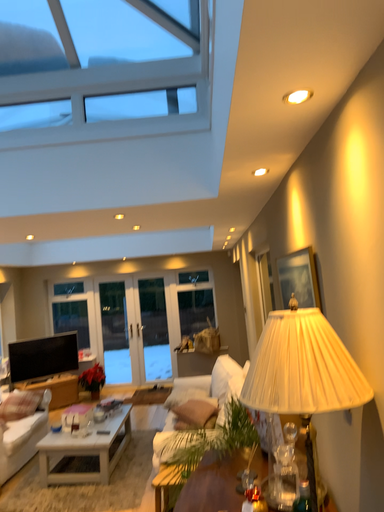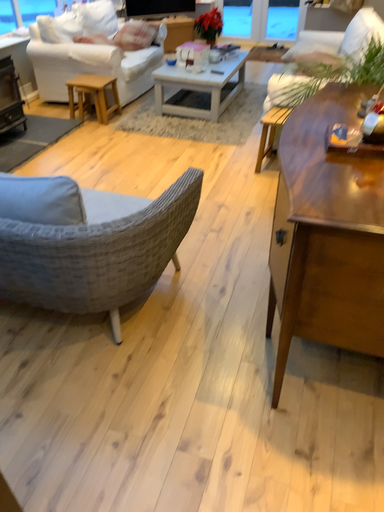
Question: Which way did the camera rotate in the video?

Choices:
 (A) rotated right
 (B) rotated left

Answer: (B)